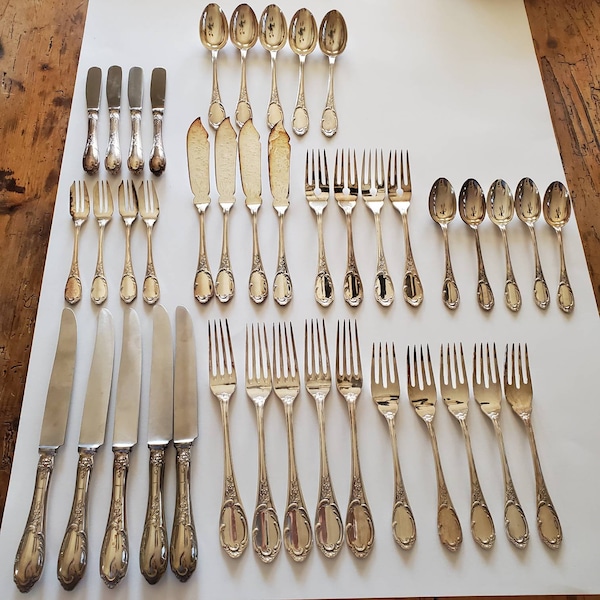
Where is `white mat`? Image resolution: width=600 pixels, height=600 pixels. white mat is located at coordinates (390, 51), (559, 419), (125, 21), (169, 257), (216, 580), (464, 76), (505, 144), (382, 144), (442, 30), (467, 126).